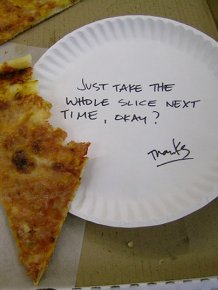
Find the location of `top of plate`. top of plate is located at coordinates (129, 16).